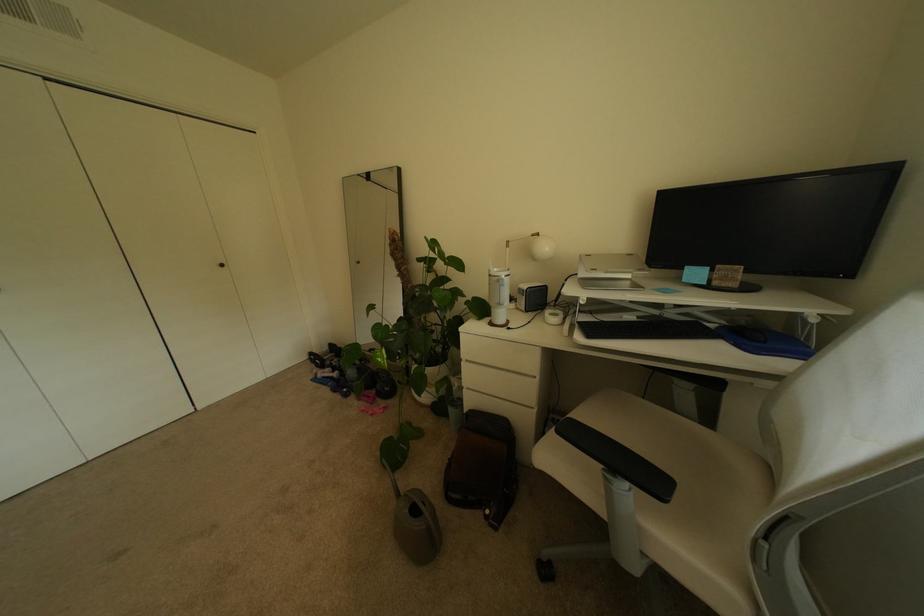
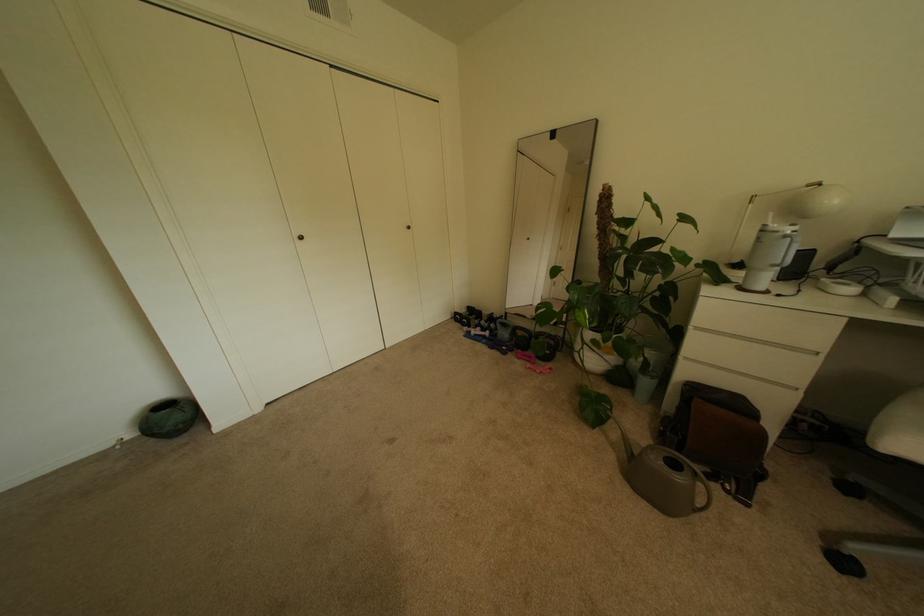
The point at (513, 277) is marked in the first image. Where is the corresponding point in the second image?

(796, 233)